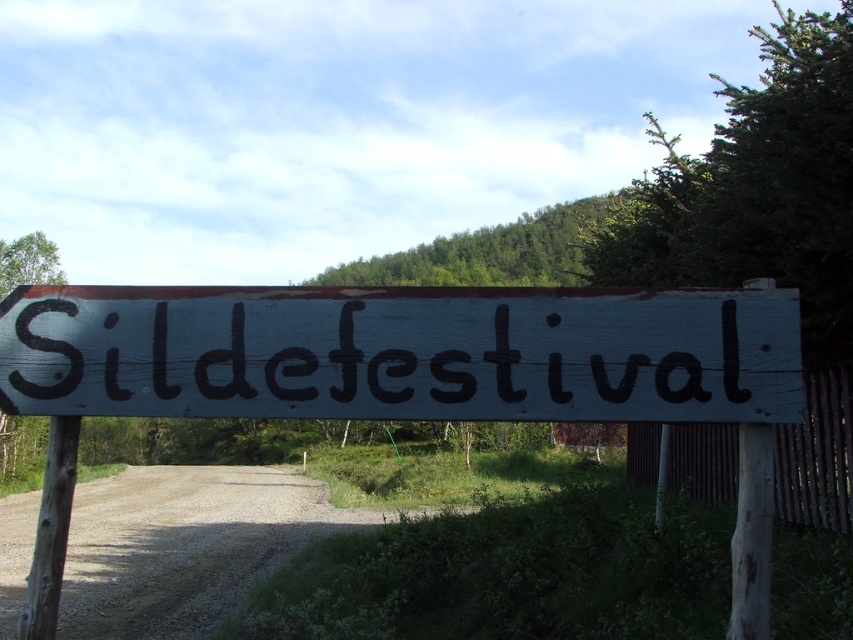
Looking at this image, is white wooden signboard at center thinner than wooden signboard at center?

No.

Which of these two, white wooden signboard at center or wooden signboard at center, stands taller?

Standing taller between the two is white wooden signboard at center.

This screenshot has width=853, height=640. What do you see at coordinates (405, 372) in the screenshot?
I see `white wooden signboard at center` at bounding box center [405, 372].

Locate an element on the screen. white wooden signboard at center is located at coordinates (405, 372).